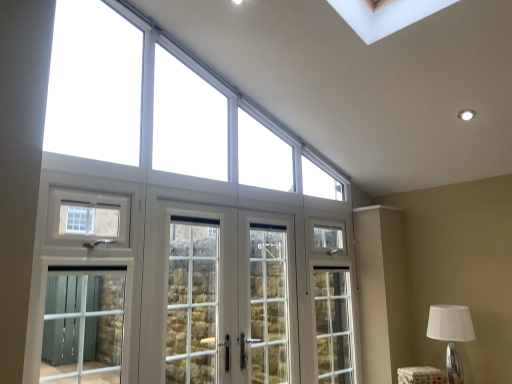
Question: Is white glass door at center, arranged as the first screen door when viewed from the left, positioned beyond the bounds of white glass doors at center, acting as the second screen door starting from the right?

Choices:
 (A) no
 (B) yes

Answer: (A)

Question: Can you confirm if white glass door at center, arranged as the first screen door when viewed from the left, is bigger than white glass doors at center, acting as the second screen door starting from the right?

Choices:
 (A) yes
 (B) no

Answer: (B)

Question: Is white glass door at center, arranged as the first screen door when viewed from the left, closer to the viewer compared to white glass doors at center, acting as the second screen door starting from the right?

Choices:
 (A) yes
 (B) no

Answer: (B)

Question: Is white glass door at center, arranged as the first screen door when viewed from the left, positioned behind white glass doors at center, which is counted as the 2th screen door, starting from the left?

Choices:
 (A) yes
 (B) no

Answer: (A)

Question: Is white glass door at center, arranged as the first screen door when viewed from the left, to the left of white glass doors at center, acting as the second screen door starting from the right, from the viewer's perspective?

Choices:
 (A) no
 (B) yes

Answer: (B)

Question: Can you confirm if white glass door at center, marked as the 3th screen door in a right-to-left arrangement, is shorter than white glass doors at center, which is counted as the 2th screen door, starting from the left?

Choices:
 (A) no
 (B) yes

Answer: (B)

Question: Is white fabric lampshade at lower right oriented away from white glass doors at center, acting as the second screen door starting from the right?

Choices:
 (A) yes
 (B) no

Answer: (B)

Question: Does white fabric lampshade at lower right have a greater height compared to white glass doors at center, acting as the second screen door starting from the right?

Choices:
 (A) no
 (B) yes

Answer: (A)

Question: From the image's perspective, is white fabric lampshade at lower right on white glass doors at center, which is counted as the 2th screen door, starting from the left?

Choices:
 (A) no
 (B) yes

Answer: (A)

Question: From a real-world perspective, does white fabric lampshade at lower right stand above white glass doors at center, which is counted as the 2th screen door, starting from the left?

Choices:
 (A) yes
 (B) no

Answer: (B)

Question: Is white fabric lampshade at lower right far away from white glass doors at center, acting as the second screen door starting from the right?

Choices:
 (A) no
 (B) yes

Answer: (B)

Question: Considering the relative sizes of white fabric lampshade at lower right and white glass doors at center, which is counted as the 2th screen door, starting from the left, in the image provided, is white fabric lampshade at lower right shorter than white glass doors at center, which is counted as the 2th screen door, starting from the left,?

Choices:
 (A) no
 (B) yes

Answer: (B)

Question: From the image's perspective, does white glass doors at center, which is counted as the 2th screen door, starting from the left, appear lower than clear glass door at center, the 1th screen door when ordered from right to left?

Choices:
 (A) yes
 (B) no

Answer: (B)